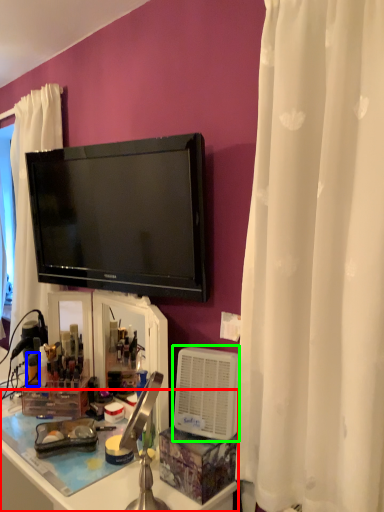
Question: Which object is positioned farthest from desk (highlighted by a red box)? Select from toiletry (highlighted by a blue box) and appliance (highlighted by a green box).

Choices:
 (A) toiletry
 (B) appliance

Answer: (A)